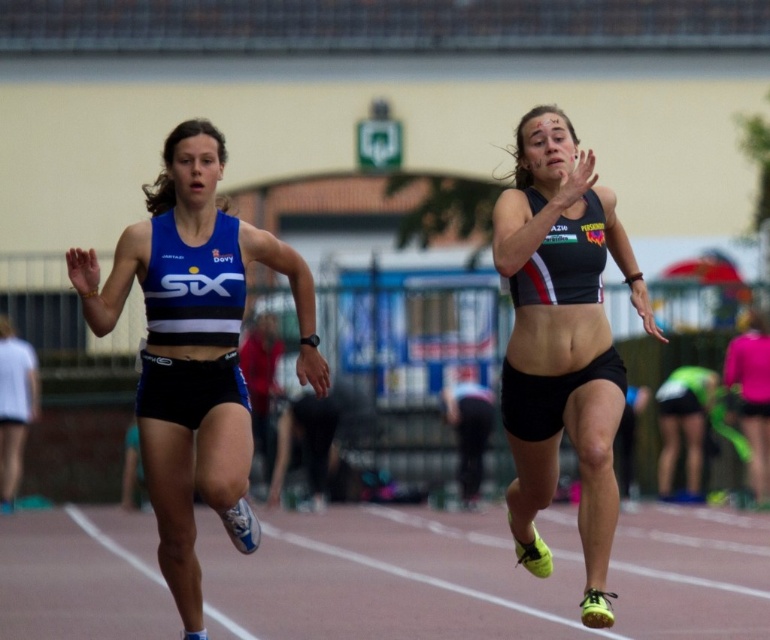
This screenshot has height=640, width=770. I want to click on blue matte sports bra at left, so click(x=193, y=348).

Is point (201, 497) farther from viewer compared to point (554, 234)?

Yes, point (201, 497) is farther from viewer.

Who is more distant from viewer, (146, 339) or (536, 122)?

The point (146, 339) is behind.

The width and height of the screenshot is (770, 640). Find the location of `blue matte sports bra at left`. blue matte sports bra at left is located at coordinates (193, 348).